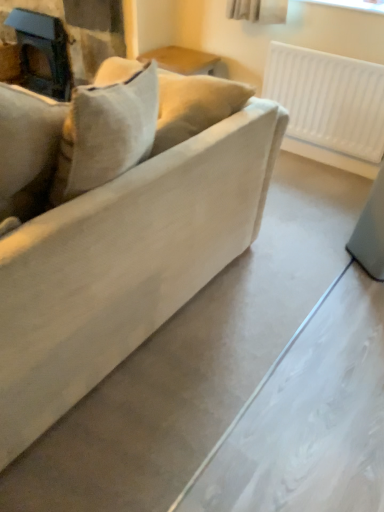
Question: Looking at their shapes, would you say matte beige couch at center is wider or thinner than white plastic radiator at upper right?

Choices:
 (A) thin
 (B) wide

Answer: (B)

Question: Is matte beige couch at center taller or shorter than white plastic radiator at upper right?

Choices:
 (A) short
 (B) tall

Answer: (B)

Question: Which is farther from the matte beige couch at center?

Choices:
 (A) white plastic radiator at upper right
 (B) matte black fireplace at upper left

Answer: (B)

Question: Considering the real-world distances, which object is closest to the white plastic radiator at upper right?

Choices:
 (A) matte black fireplace at upper left
 (B) matte beige couch at center

Answer: (A)